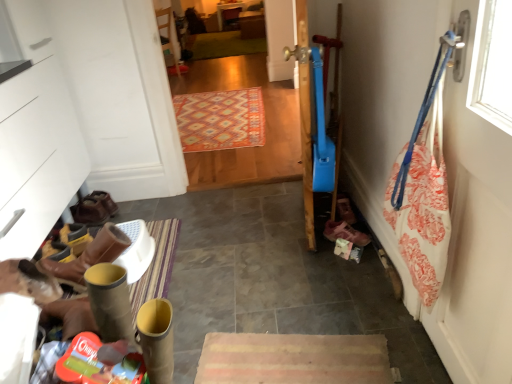
Question: Does green carpet at center, which is the 2th mat from bottom to top, contain multicolored woven rug at center, the 1th mat viewed from the front?

Choices:
 (A) yes
 (B) no

Answer: (B)

Question: Is green carpet at center, placed as the 2th mat when sorted from front to back, at the left side of multicolored woven rug at center, which appears as the 1th mat when ordered from the bottom?

Choices:
 (A) no
 (B) yes

Answer: (B)

Question: Is green carpet at center, the first mat from the back, taller than multicolored woven rug at center, which appears as the 1th mat when ordered from the bottom?

Choices:
 (A) no
 (B) yes

Answer: (A)

Question: Is the depth of green carpet at center, which is the 2th mat from bottom to top, less than that of multicolored woven rug at center, which appears as the 1th mat when ordered from the bottom?

Choices:
 (A) no
 (B) yes

Answer: (A)

Question: Could you tell me if green carpet at center, the first mat positioned from the top, is facing multicolored woven rug at center, the 2th mat when ordered from top to bottom?

Choices:
 (A) no
 (B) yes

Answer: (A)

Question: From the image's perspective, does green carpet at center, placed as the 2th mat when sorted from front to back, appear lower than multicolored woven rug at center, which appears as the 1th mat when ordered from the bottom?

Choices:
 (A) yes
 (B) no

Answer: (B)

Question: Does green carpet at center, the first mat positioned from the top, have a greater height compared to pink fabric shoe at lower right, placed as the first footwear when sorted from right to left?

Choices:
 (A) no
 (B) yes

Answer: (A)

Question: Considering the relative sizes of green carpet at center, the first mat from the back, and pink fabric shoe at lower right, placed as the first footwear when sorted from right to left, in the image provided, is green carpet at center, the first mat from the back, smaller than pink fabric shoe at lower right, placed as the first footwear when sorted from right to left,?

Choices:
 (A) no
 (B) yes

Answer: (A)

Question: Is green carpet at center, the first mat from the back, outside of pink fabric shoe at lower right, the third footwear in the left-to-right sequence?

Choices:
 (A) no
 (B) yes

Answer: (B)

Question: From a real-world perspective, does green carpet at center, placed as the 2th mat when sorted from front to back, sit lower than pink fabric shoe at lower right, which is the 1th footwear in front-to-back order?

Choices:
 (A) no
 (B) yes

Answer: (B)

Question: Is green carpet at center, the first mat from the back, aimed at pink fabric shoe at lower right, which is the 1th footwear in front-to-back order?

Choices:
 (A) no
 (B) yes

Answer: (A)

Question: Is green carpet at center, placed as the 2th mat when sorted from front to back, to the right of pink fabric shoe at lower right, the 3th footwear positioned from the back, from the viewer's perspective?

Choices:
 (A) yes
 (B) no

Answer: (B)

Question: Considering the relative positions of pink fabric shoe at lower right, which is the 1th footwear in front-to-back order, and brown leather boots at lower left, marked as the 3th footwear in a front-to-back arrangement, in the image provided, is pink fabric shoe at lower right, which is the 1th footwear in front-to-back order, to the right of brown leather boots at lower left, marked as the 3th footwear in a front-to-back arrangement, from the viewer's perspective?

Choices:
 (A) yes
 (B) no

Answer: (A)